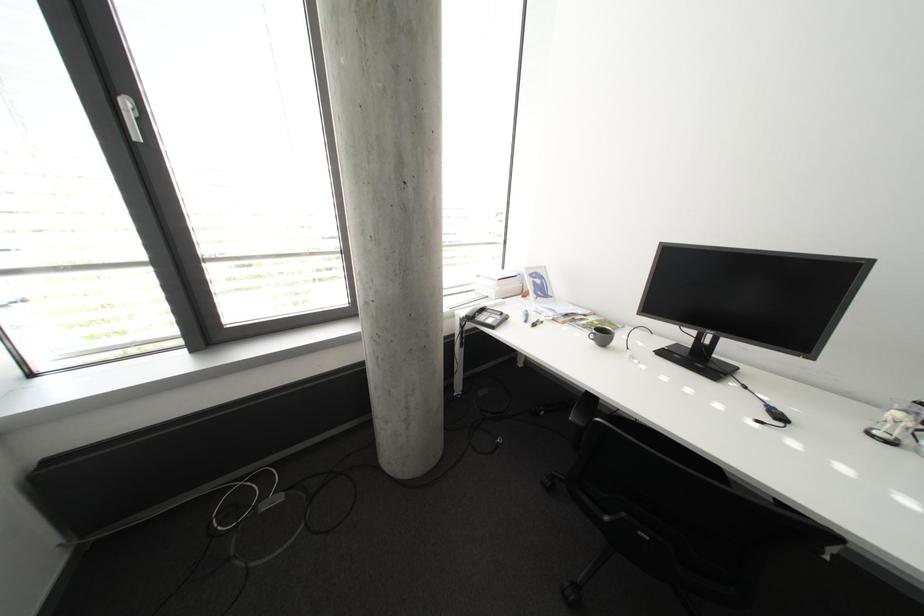
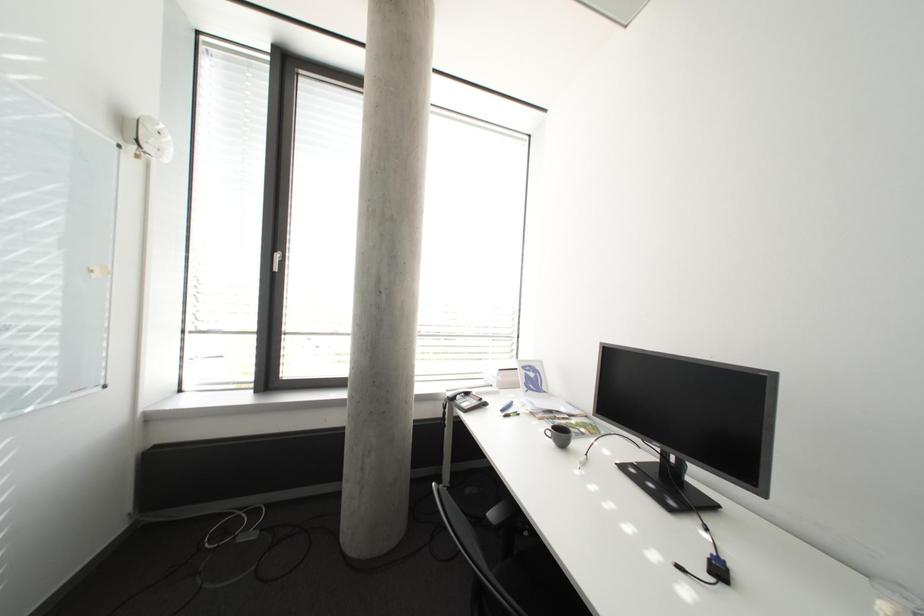
The images are taken continuously from a first-person perspective. In which direction is your viewpoint rotating?

The camera's rotation is toward left-up.